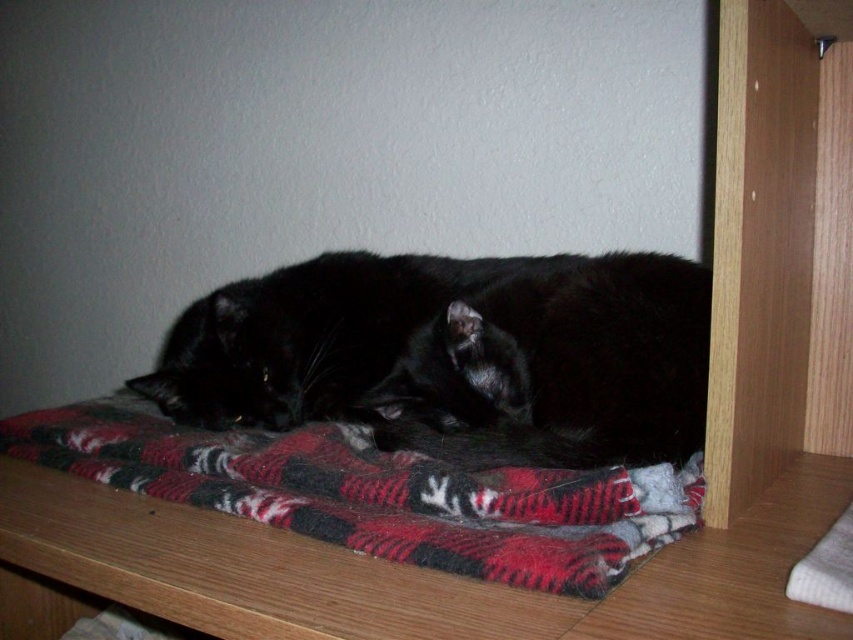
You are a photographer trying to capture a closeup of the black fuzzy cat at center and the red plaid blanket at center. Which object is taller so that it will be in focus if you adjust the camera focus to match its height?

The black fuzzy cat at center is taller than the red plaid blanket at center, so adjusting the camera focus to match the cat will ensure it is in focus.

You are a photographer trying to capture a closeup of the black fuzzy cat at center. Since the red plaid blanket at center is in the way, you need to adjust your angle. Which direction should you move your camera to get the cat in focus without the blanket blocking the view?

The black fuzzy cat at center is located above the red plaid blanket at center. To avoid the blanket blocking the view, you should move your camera upwards to focus on the cat.